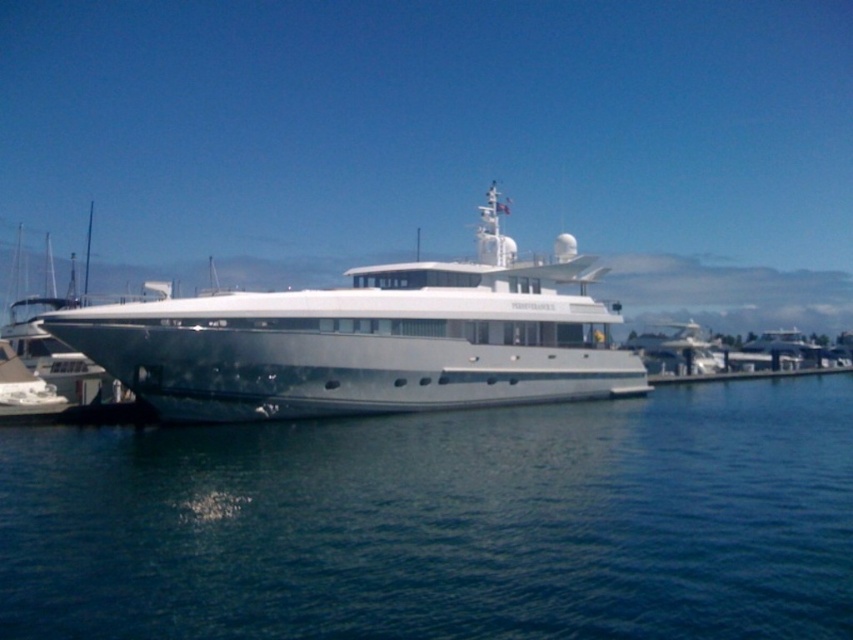
Question: Is blue water at center wider than white glossy cruise ship at center?

Choices:
 (A) yes
 (B) no

Answer: (A)

Question: Which object is farther from the camera taking this photo?

Choices:
 (A) blue water at center
 (B) white glossy cruise ship at center

Answer: (B)

Question: Does blue water at center have a lesser width compared to white glossy cruise ship at center?

Choices:
 (A) no
 (B) yes

Answer: (A)

Question: Which object appears closest to the camera in this image?

Choices:
 (A) white glossy cruise ship at center
 (B) blue water at center

Answer: (B)

Question: Is blue water at center closer to the viewer compared to white glossy cruise ship at center?

Choices:
 (A) yes
 (B) no

Answer: (A)